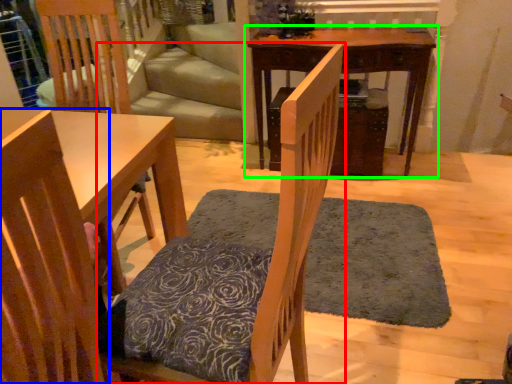
Question: Which object is the closest to the chair (highlighted by a red box)? Choose among these: chair (highlighted by a blue box) or table (highlighted by a green box).

Choices:
 (A) chair
 (B) table

Answer: (A)